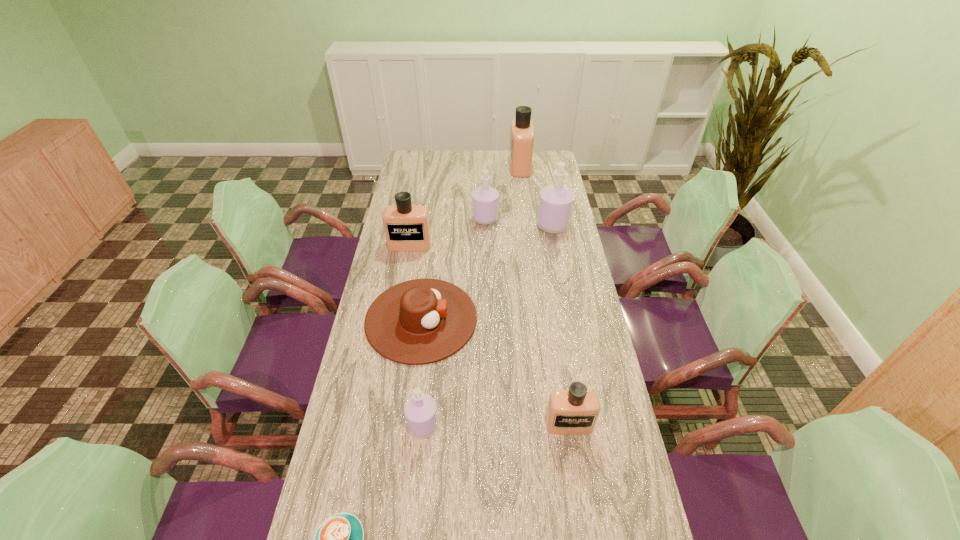
Locate an element on the screen. This screenshot has height=540, width=960. the farthest beige perfume is located at coordinates (522, 131).

Find the location of a particular element. the biggest beige perfume is located at coordinates tap(522, 131).

This screenshot has width=960, height=540. I want to click on the rightmost purple perfume, so click(556, 202).

This screenshot has height=540, width=960. Identify the location of the second smallest purple perfume. pos(485,200).

Identify the location of the fourth perfume from right to left. (485, 200).

Where is `the fourth farthest object`? The image size is (960, 540). the fourth farthest object is located at coordinates (406, 226).

Locate an element on the screen. This screenshot has width=960, height=540. the leftmost beige perfume is located at coordinates (406, 226).

Where is `the smallest purple perfume`? The height and width of the screenshot is (540, 960). the smallest purple perfume is located at coordinates (420, 410).

I want to click on the leftmost purple perfume, so click(x=420, y=410).

Locate an element on the screen. The image size is (960, 540). the nearest beige perfume is located at coordinates (575, 411).